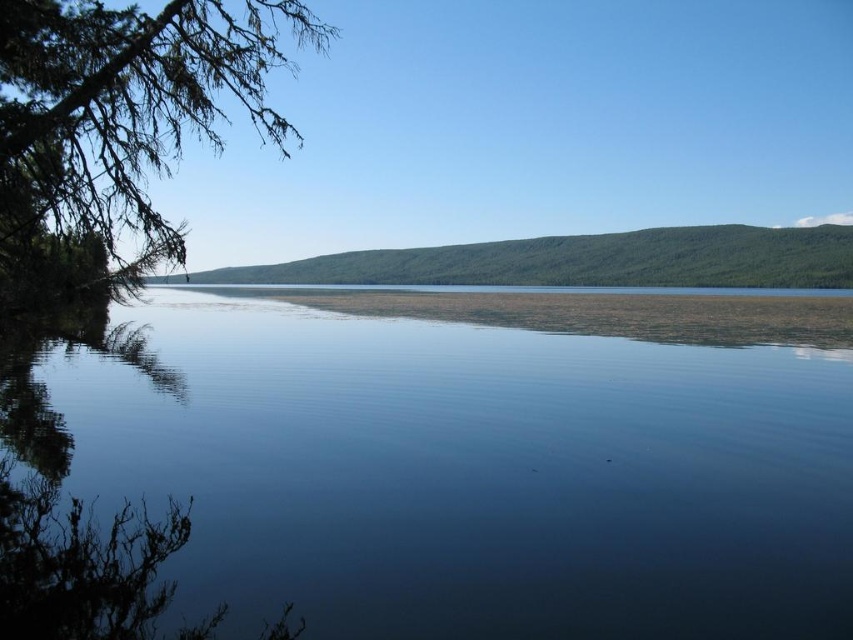
Based on the photo, you are standing at the edge of the deep blue water at center and looking towards the green leafy branch at upper left. Which object appears larger in the scene?

The green leafy branch at upper left appears larger than the deep blue water at center because the deep blue water at center has a smaller size compared to green leafy branch at upper left.

You are standing at the edge of the scene and want to locate the deep blue water at center. According to the coordinates provided, in which direction should you look to find it?

The deep blue water at center is located at coordinates point (415, 481), so you should look to the lower right direction to find it.